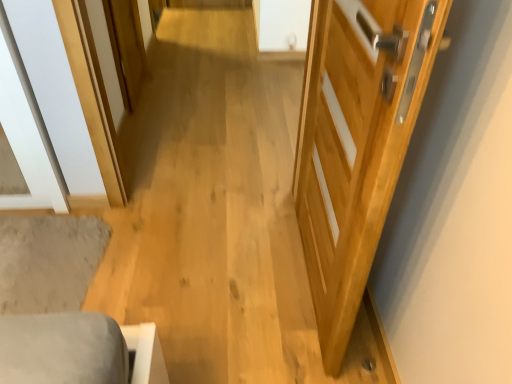
The image size is (512, 384). Find the location of `natural wood door at right`. natural wood door at right is located at coordinates (356, 142).

What do you see at coordinates (356, 142) in the screenshot?
I see `natural wood door at right` at bounding box center [356, 142].

In order to face natural wood door at right, should I rotate leftwards or rightwards?

A 8.825 degree turn to the right will do.

The image size is (512, 384). What are the coordinates of `natural wood door at right` in the screenshot? It's located at (356, 142).